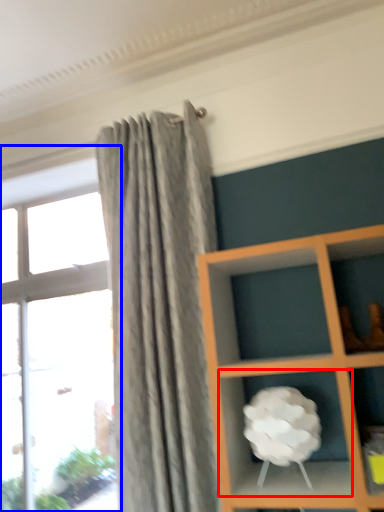
Question: Which of the following is the farthest to the observer, cabinet (highlighted by a red box) or window (highlighted by a blue box)?

Choices:
 (A) cabinet
 (B) window

Answer: (B)